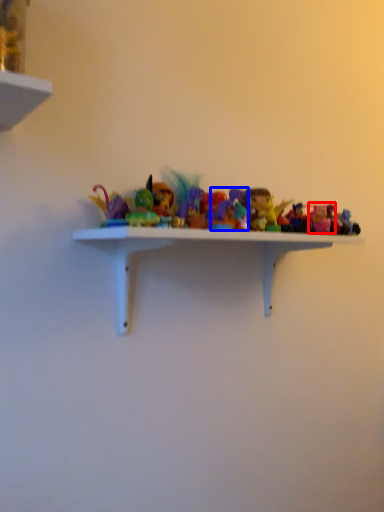
Question: Which of the following is the farthest to the observer, toy (highlighted by a red box) or toy (highlighted by a blue box)?

Choices:
 (A) toy
 (B) toy

Answer: (A)